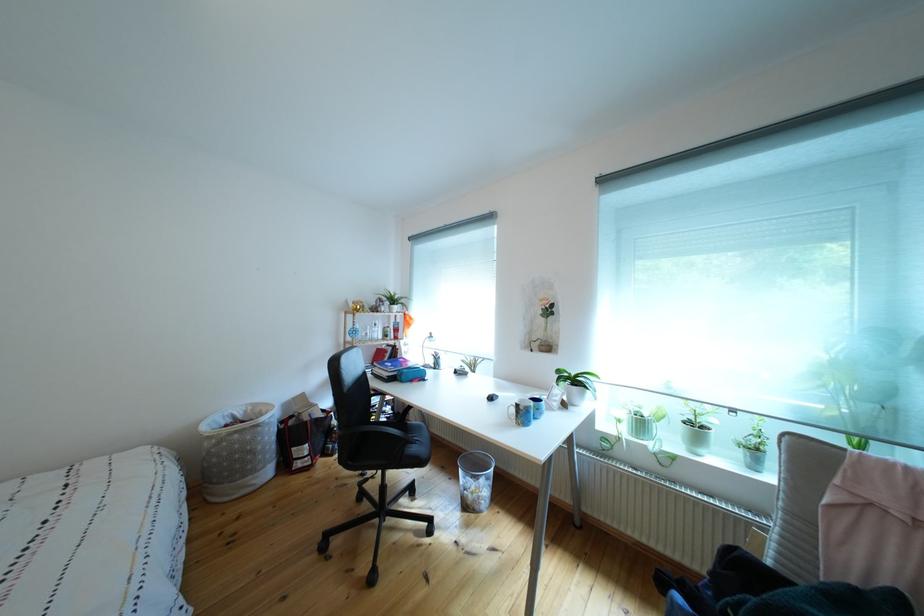
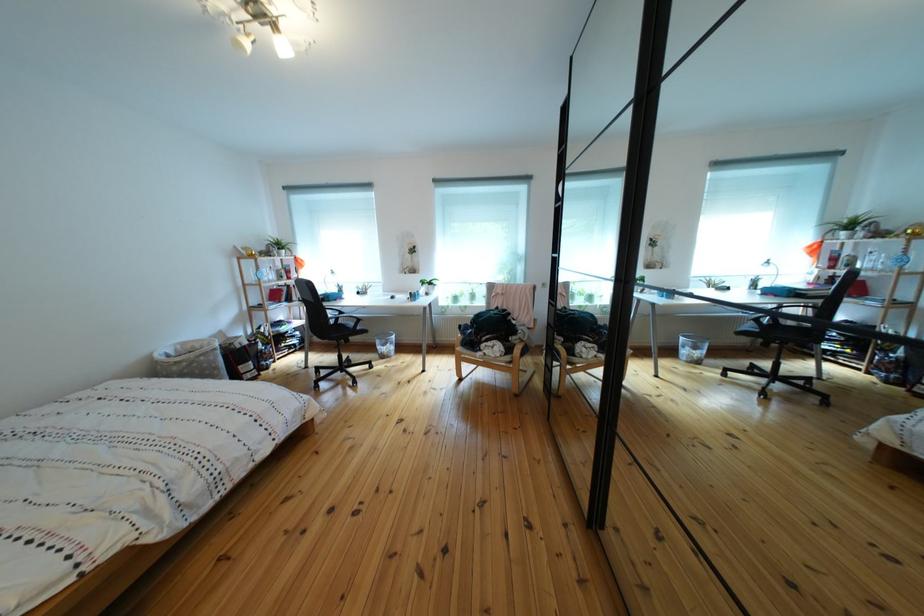
Locate, in the second image, the point that corresponds to the point at 383,345 in the first image.

(282, 286)